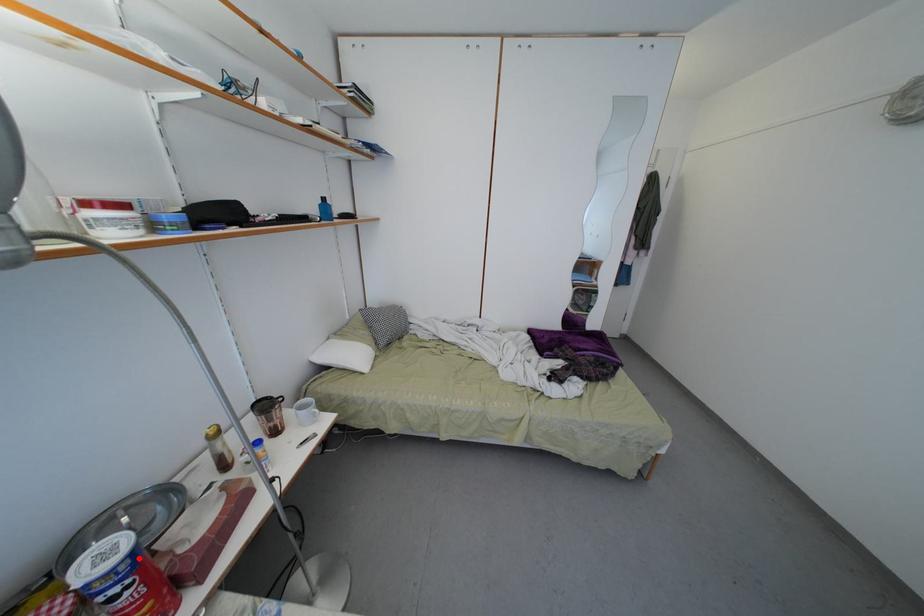
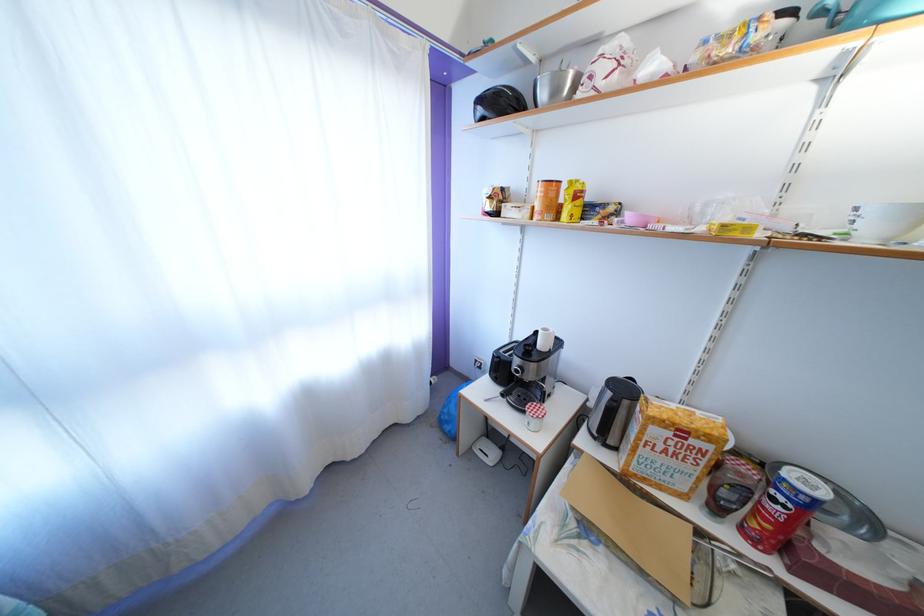
Question: I am providing you with two images of the same scene from different viewpoints. A red point is shown in image1. For the corresponding object point in image2, is it positioned nearer or farther from the camera?

Choices:
 (A) Nearer
 (B) Farther

Answer: (A)